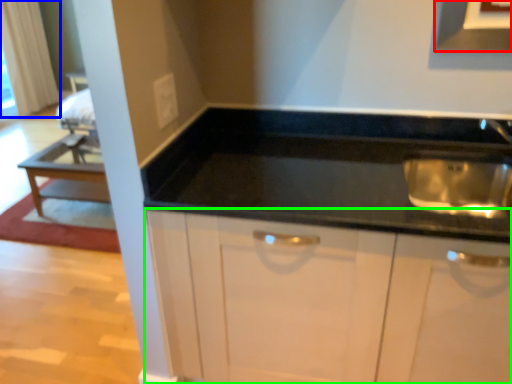
Question: Which object is positioned farthest from exhaust hood (highlighted by a red box)? Select from curtain (highlighted by a blue box) and cabinetry (highlighted by a green box).

Choices:
 (A) curtain
 (B) cabinetry

Answer: (A)